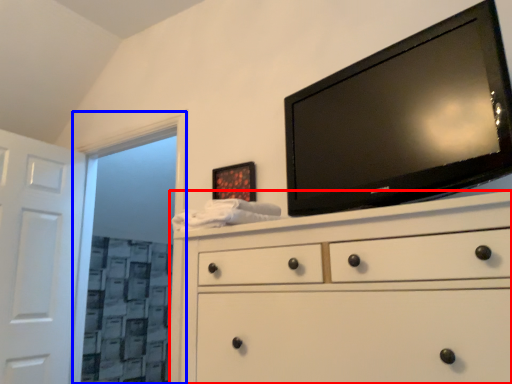
Question: Which object is closer to the camera taking this photo, chest of drawers (highlighted by a red box) or glass door (highlighted by a blue box)?

Choices:
 (A) chest of drawers
 (B) glass door

Answer: (A)